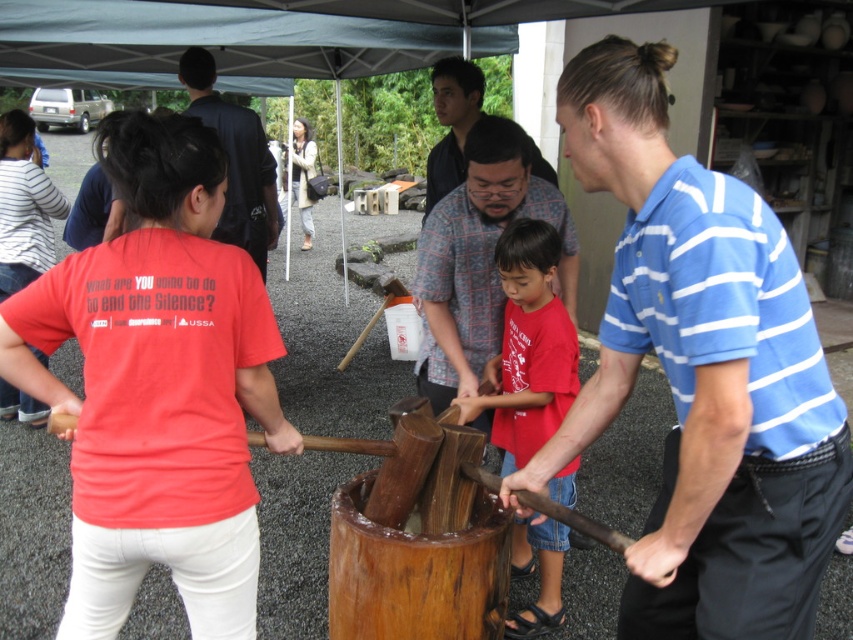
Between matte red shirt at center and plaid shirt at center, which one has more height?

Standing taller between the two is matte red shirt at center.

Is matte red shirt at center to the right of plaid shirt at center from the viewer's perspective?

Indeed, matte red shirt at center is positioned on the right side of plaid shirt at center.

The height and width of the screenshot is (640, 853). I want to click on matte red shirt at center, so click(527, 348).

Can you confirm if blue striped shirt at center is positioned below dark blue suit at upper left?

Indeed, blue striped shirt at center is positioned under dark blue suit at upper left.

Who is positioned more to the left, blue striped shirt at center or dark blue suit at upper left?

dark blue suit at upper left

Who is more distant from viewer, (683, 269) or (257, 152)?

Positioned behind is point (257, 152).

The image size is (853, 640). I want to click on blue striped shirt at center, so click(x=701, y=372).

Who is positioned more to the right, matte red shirt at center or patterned fabric shirt at center?

Positioned to the right is matte red shirt at center.

Is matte red shirt at center wider than patterned fabric shirt at center?

Yes, matte red shirt at center is wider than patterned fabric shirt at center.

Is point (535, 304) positioned in front of point (450, 108)?

That is True.

Find the location of a particular element. The width and height of the screenshot is (853, 640). matte red shirt at center is located at coordinates (527, 348).